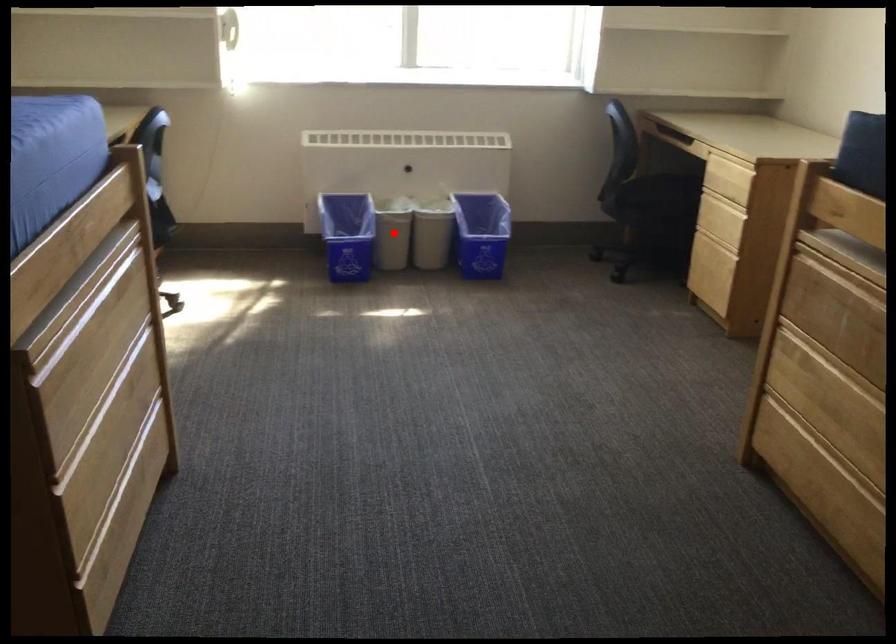
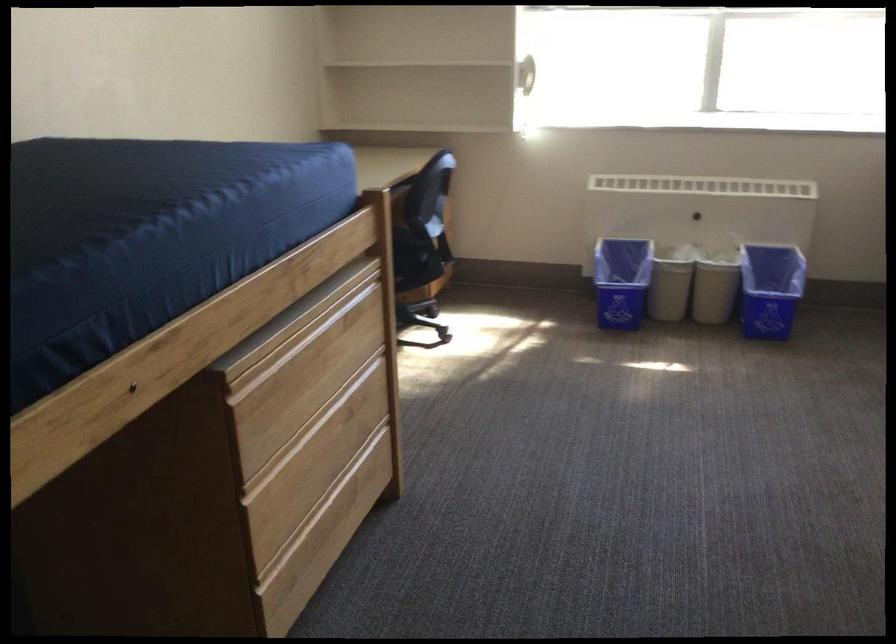
Find the pixel in the second image that matches the highlighted location in the first image.

(670, 281)